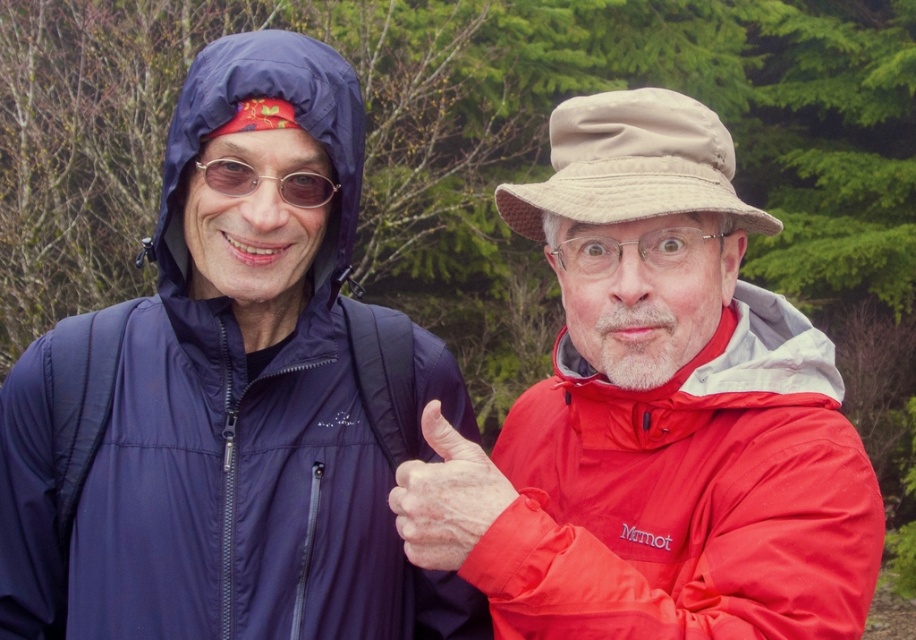
Based on the photo, you are a photographer trying to capture both the matte red jacket at right and the matte plastic glasses at upper center in the same frame. Which object should you focus on first to ensure both are in the frame?

The matte red jacket at right is larger than the matte plastic glasses at upper center, so you should focus on the matte red jacket at right first to ensure both are in the frame.

You are a photographer trying to capture a closeup shot of the matte plastic glasses at upper center. The navy blue waterproof jacket at left is blocking your view. Can you estimate how far you need to move to the right to avoid the jacket?

The navy blue waterproof jacket at left is 9.25 inches from the matte plastic glasses at upper center. To avoid the jacket, you need to move at least 9.25 inches to the right.